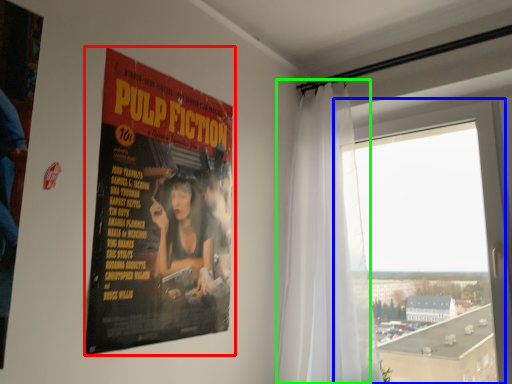
Question: Based on their relative distances, which object is nearer to poster (highlighted by a red box)? Choose from window (highlighted by a blue box) and curtain (highlighted by a green box).

Choices:
 (A) window
 (B) curtain

Answer: (B)